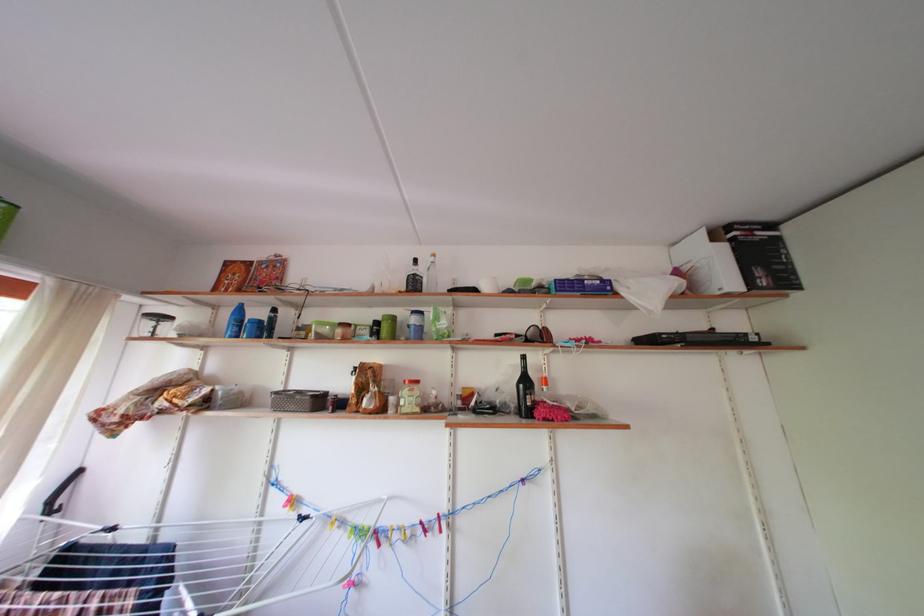
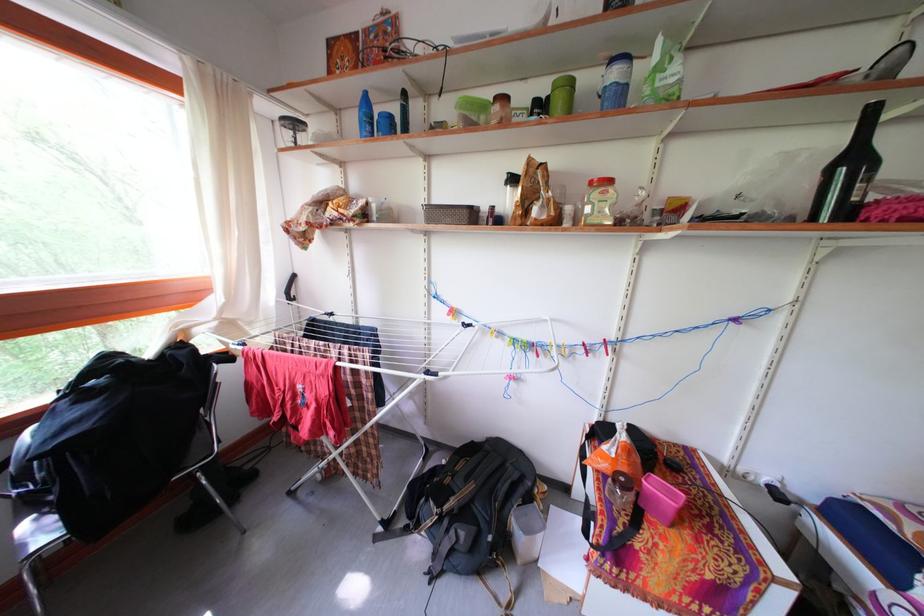
Locate, in the second image, the point that corresponds to point (422, 326) in the first image.

(623, 81)